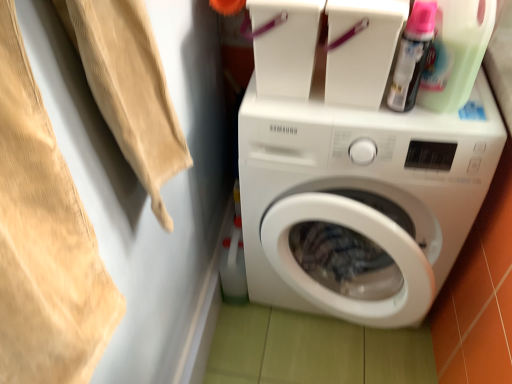
Question: Do you think translucent plastic spray can at upper right, the 2th cleaning product positioned from the right, is within white glossy washing machine at center, or outside of it?

Choices:
 (A) inside
 (B) outside

Answer: (B)

Question: From a real-world perspective, is translucent plastic spray can at upper right, the 2th cleaning product positioned from the right, positioned above or below white glossy washing machine at center?

Choices:
 (A) below
 (B) above

Answer: (B)

Question: Estimate the real-world distances between objects in this image. Which object is closer to the translucent plastic spray can at upper right, the 2th cleaning product positioned from the right?

Choices:
 (A) green translucent bottle at upper right, marked as the first cleaning product in a right-to-left arrangement
 (B) white glossy washing machine at center
 (C) beige cotton towel at upper left

Answer: (A)

Question: Which of these objects is positioned farthest from the beige cotton towel at upper left?

Choices:
 (A) green translucent bottle at upper right, marked as the first cleaning product in a right-to-left arrangement
 (B) white glossy washing machine at center
 (C) translucent plastic spray can at upper right, the 2th cleaning product positioned from the right

Answer: (A)